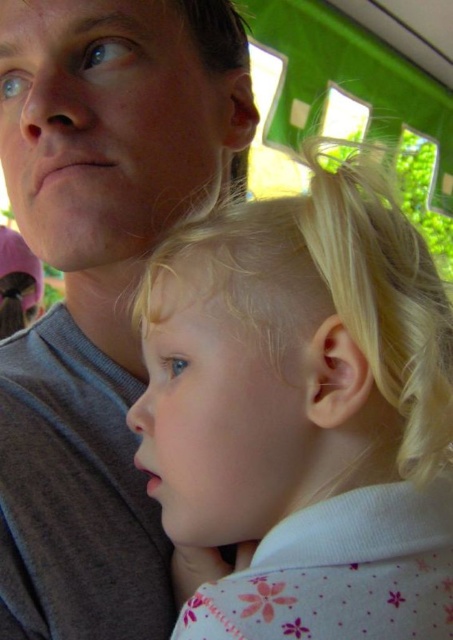
You are a photographer trying to capture a photo of the blonde hair at center and the gray cotton shirt at upper left. The camera can only focus on objects within a 5 inch range. Will both objects be in focus?

The distance between the blonde hair at center and the gray cotton shirt at upper left is 5.38 inches, which exceeds the camera focus range of 5 inches. Therefore, both objects cannot be in focus simultaneously.

You are a photographer trying to capture a close shot of the blonde hair at center. You have a camera with a minimum focusing distance of 12 inches. Can you take the photo without moving the camera closer?

The distance between the blonde hair at center and the camera is 10.96 inches, which is less than the camera minimum focusing distance of 12 inches. Therefore, you cannot take the photo without moving the camera closer.